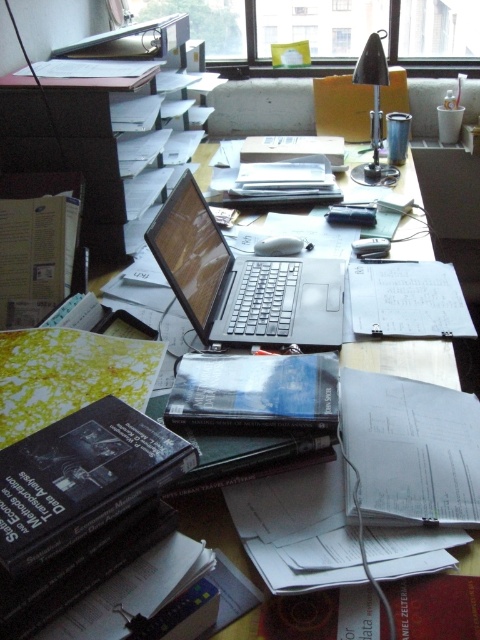
Between satin black laptop at center and black metallic lamp at upper right, which one appears on the left side from the viewer's perspective?

satin black laptop at center

Looking at this image, between satin black laptop at center and black metallic lamp at upper right, which one appears on the right side from the viewer's perspective?

black metallic lamp at upper right is more to the right.

The height and width of the screenshot is (640, 480). What are the coordinates of `satin black laptop at center` in the screenshot? It's located at (242, 282).

You are a GUI agent. You are given a task and a screenshot of the screen. Output one action in this format:
    pyautogui.click(x=<x>, y=<y>)
    Task: Click on the satin black laptop at center
    
    Given the screenshot: What is the action you would take?
    tap(242, 282)

Who is more forward, (181, 282) or (277, 381)?

Positioned in front is point (277, 381).

Image resolution: width=480 pixels, height=640 pixels. Describe the element at coordinates (242, 282) in the screenshot. I see `satin black laptop at center` at that location.

Does point (230, 272) lie behind point (325, 390)?

Yes.

Where is `satin black laptop at center`? satin black laptop at center is located at coordinates (242, 282).

Which is below, black matte binder at lower left or black matte book at center?

black matte binder at lower left

Is point (67, 433) in front of point (312, 422)?

Yes, it is in front of point (312, 422).

Is point (166, 445) closer to camera compared to point (254, 371)?

Yes, it is.

Locate an element on the screen. This screenshot has width=480, height=640. black matte binder at lower left is located at coordinates (82, 477).